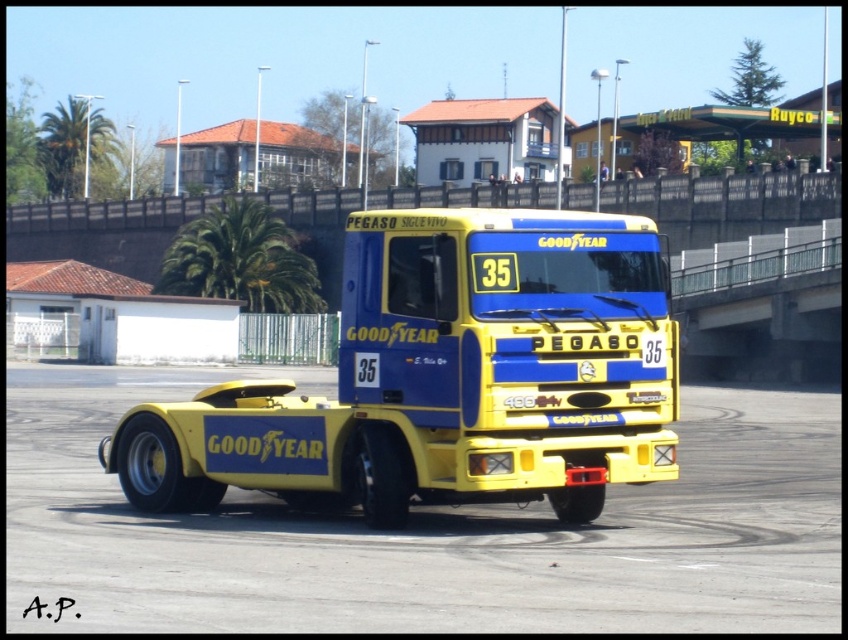
Question: Can you confirm if yellow rubber dirt track at center is positioned above shiny silver tire at lower left?

Choices:
 (A) yes
 (B) no

Answer: (B)

Question: Which point is farther to the camera?

Choices:
 (A) (367, 502)
 (B) (8, 624)
 (C) (149, 451)

Answer: (C)

Question: Is yellow matte tow truck at center further to the viewer compared to shiny silver tire at lower left?

Choices:
 (A) no
 (B) yes

Answer: (A)

Question: Does yellow rubber dirt track at center appear over yellow matte tow truck at center?

Choices:
 (A) yes
 (B) no

Answer: (B)

Question: Which object is closer to the camera taking this photo?

Choices:
 (A) yellow rubber dirt track at center
 (B) shiny silver tire at lower left

Answer: (A)

Question: Which of the following is the closest to the observer?

Choices:
 (A) yellow rubber dirt track at center
 (B) shiny silver tire at lower left

Answer: (A)